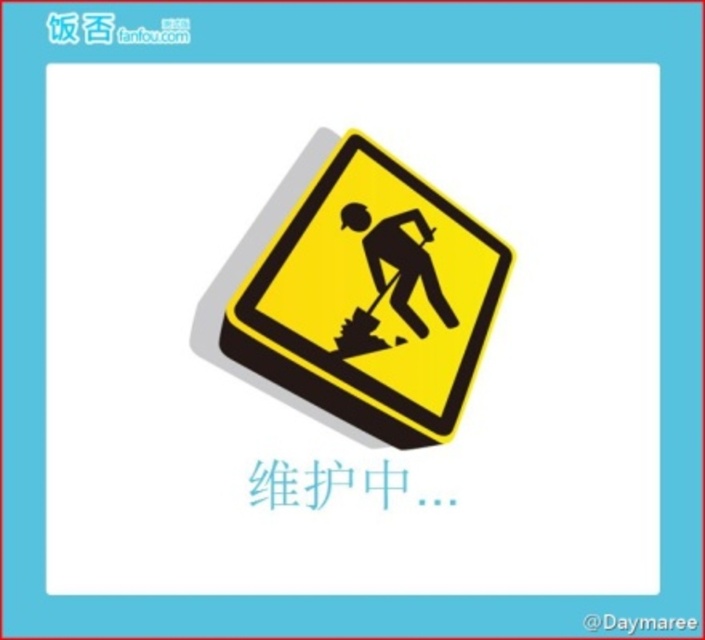
Who is higher up, yellow matte sign at center or black silhouette man at center?

black silhouette man at center

Who is positioned more to the right, yellow matte sign at center or black silhouette man at center?

Positioned to the right is black silhouette man at center.

Is point (293, 339) farther from viewer compared to point (403, 268)?

That is False.

At what (x,y) coordinates should I click in order to perform the action: click on yellow matte sign at center. Please return your answer as a coordinate pair (x, y). The width and height of the screenshot is (705, 640). Looking at the image, I should click on (362, 296).